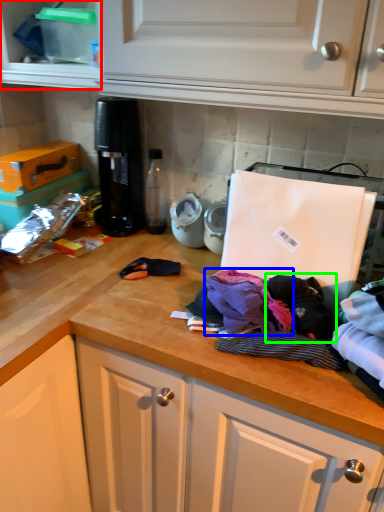
Question: Considering the real-world distances, which object is closest to cabinetry (highlighted by a red box)? clothing (highlighted by a blue box) or clothing (highlighted by a green box).

Choices:
 (A) clothing
 (B) clothing

Answer: (A)